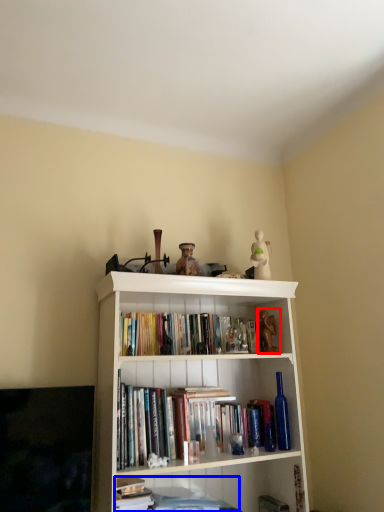
Question: Which of the following is the farthest to the observer, toy (highlighted by a red box) or book (highlighted by a blue box)?

Choices:
 (A) toy
 (B) book

Answer: (A)